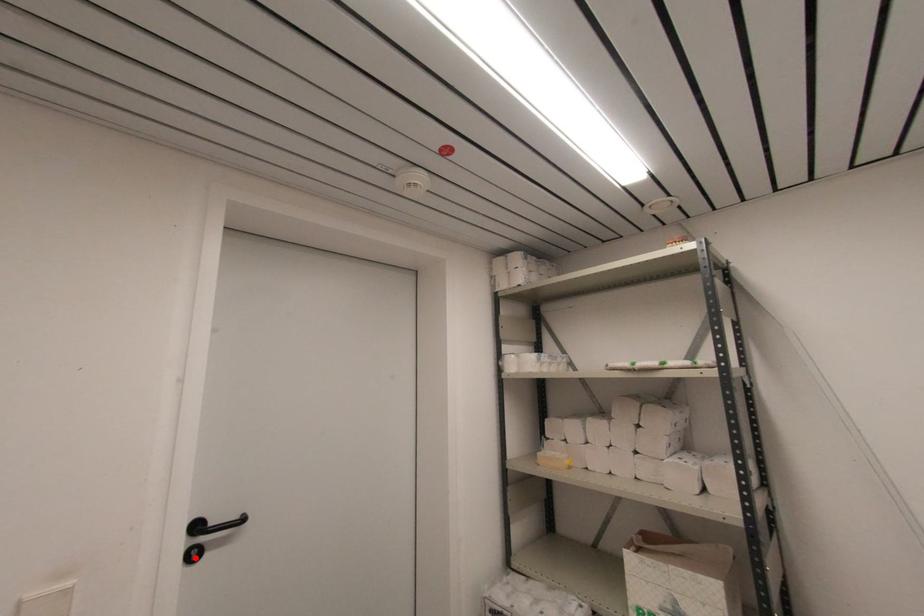
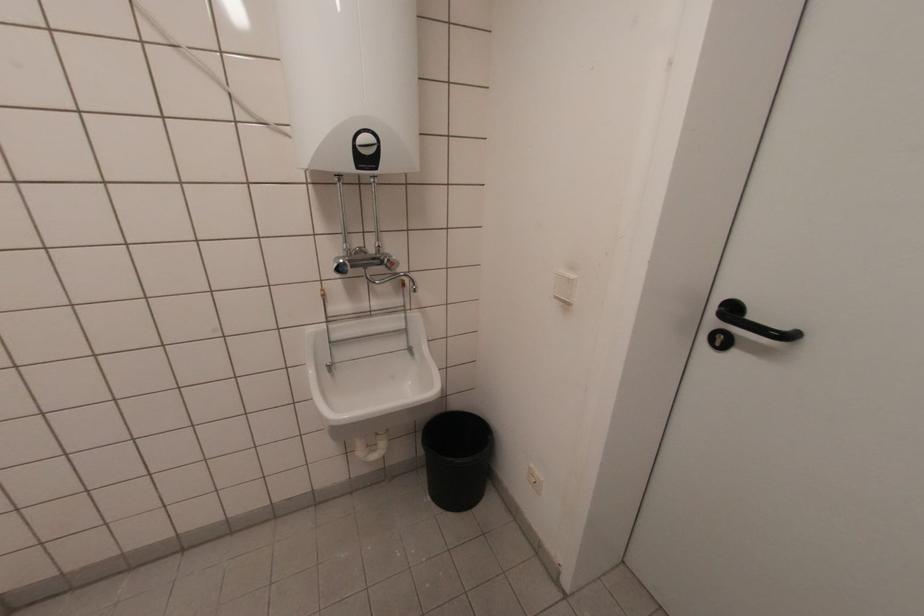
The point at the highlighted location is marked in the first image. Where is the corresponding point in the second image?

(719, 344)